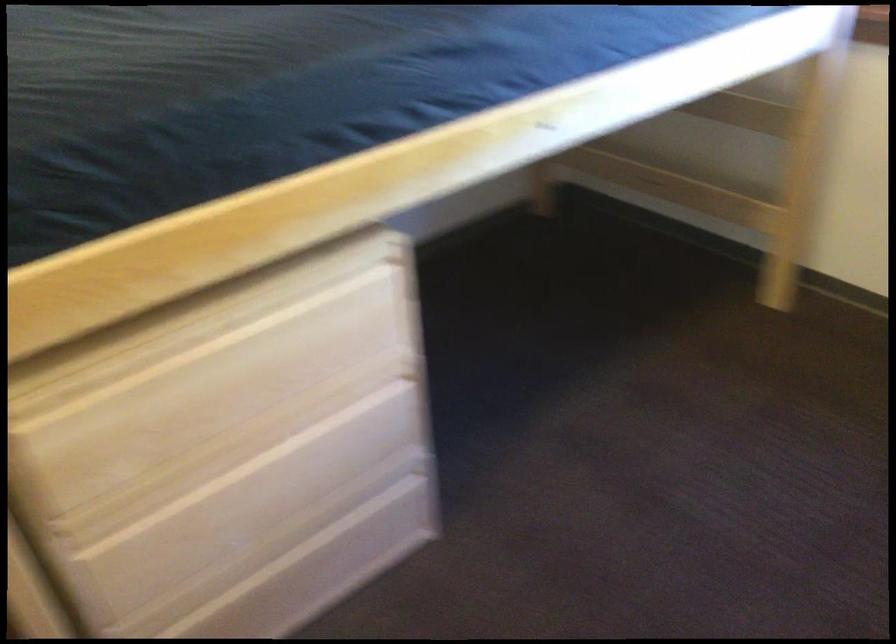
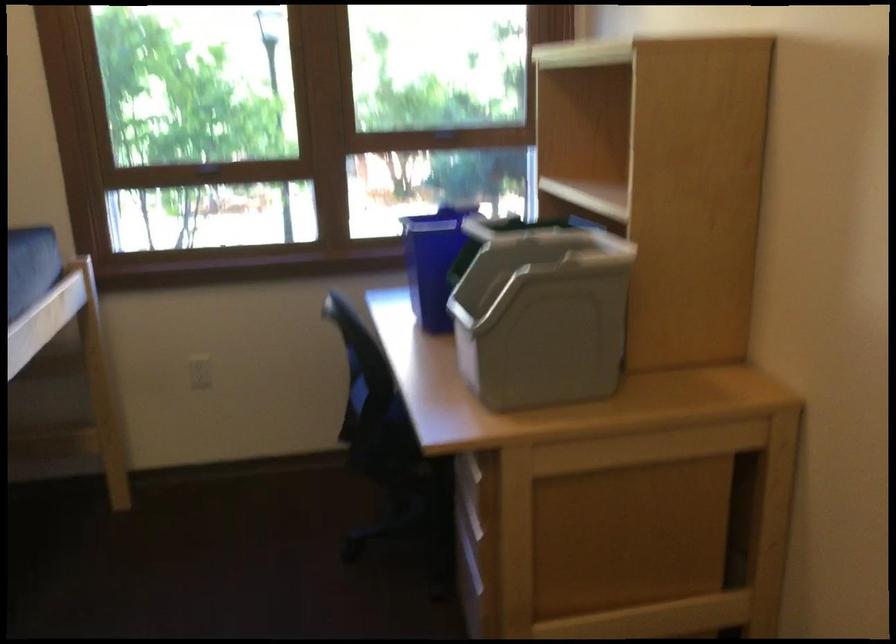
Question: How did the camera likely rotate?

Choices:
 (A) Left
 (B) Right
 (C) Up
 (D) Down

Answer: (B)